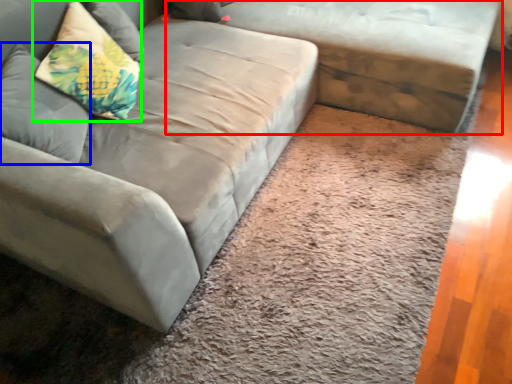
Question: Considering the real-world distances, which object is farthest from studio couch (highlighted by a red box)? pillow (highlighted by a blue box) or pillow (highlighted by a green box)?

Choices:
 (A) pillow
 (B) pillow

Answer: (A)